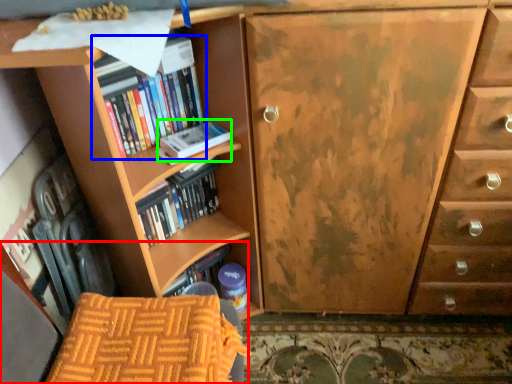
Question: Considering the real-world distances, which object is closest to armchair (highlighted by a red box)? book (highlighted by a blue box) or paperback book (highlighted by a green box).

Choices:
 (A) book
 (B) paperback book

Answer: (B)